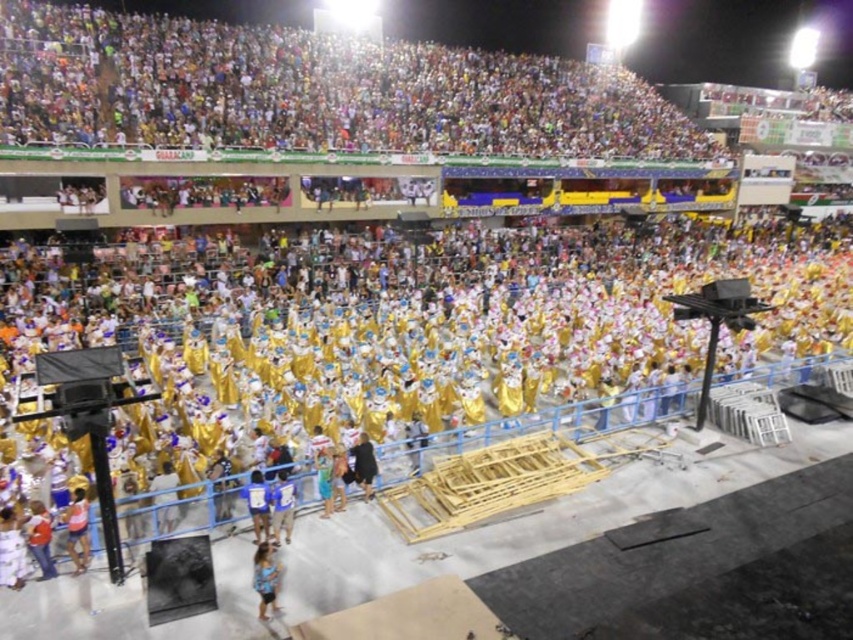
Question: Which of these objects is positioned farthest from the blue fabric dress at lower center?

Choices:
 (A) light pink fabric dress at lower left
 (B) black fabric person at center

Answer: (A)

Question: Which point is closer to the camera?

Choices:
 (A) blue fabric at lower center
 (B) blue fabric shirt at lower center

Answer: (A)

Question: Which point is closer to the camera?

Choices:
 (A) (322, 499)
 (B) (416, 465)
 (C) (270, 592)

Answer: (C)

Question: Is blue fabric shirt at lower center closer to the viewer compared to black fabric person at center?

Choices:
 (A) yes
 (B) no

Answer: (A)

Question: Considering the relative positions of orange shirt at lower left and gold fabric person at center in the image provided, where is orange shirt at lower left located with respect to gold fabric person at center?

Choices:
 (A) above
 (B) below

Answer: (B)

Question: Is blue fabric dress at lower center to the right of blue fabric at lower center from the viewer's perspective?

Choices:
 (A) no
 (B) yes

Answer: (B)